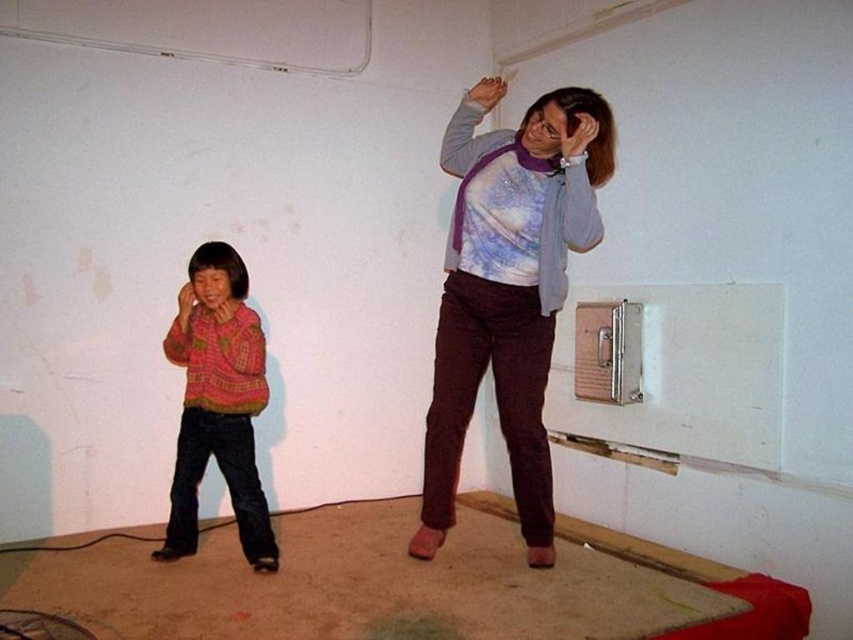
Question: Can you confirm if purple soft scarf at upper center is positioned above knitted sweater at left?

Choices:
 (A) no
 (B) yes

Answer: (B)

Question: Does purple soft scarf at upper center have a larger size compared to knitted sweater at left?

Choices:
 (A) yes
 (B) no

Answer: (A)

Question: Which of the following is the farthest from the observer?

Choices:
 (A) knitted sweater at left
 (B) purple soft scarf at upper center

Answer: (A)

Question: Which of the following is the closest to the observer?

Choices:
 (A) knitted sweater at left
 (B) purple soft scarf at upper center

Answer: (B)

Question: Observing the image, what is the correct spatial positioning of purple soft scarf at upper center in reference to knitted sweater at left?

Choices:
 (A) right
 (B) left

Answer: (A)

Question: Which point is farther from the camera taking this photo?

Choices:
 (A) (258, 524)
 (B) (543, 554)

Answer: (B)